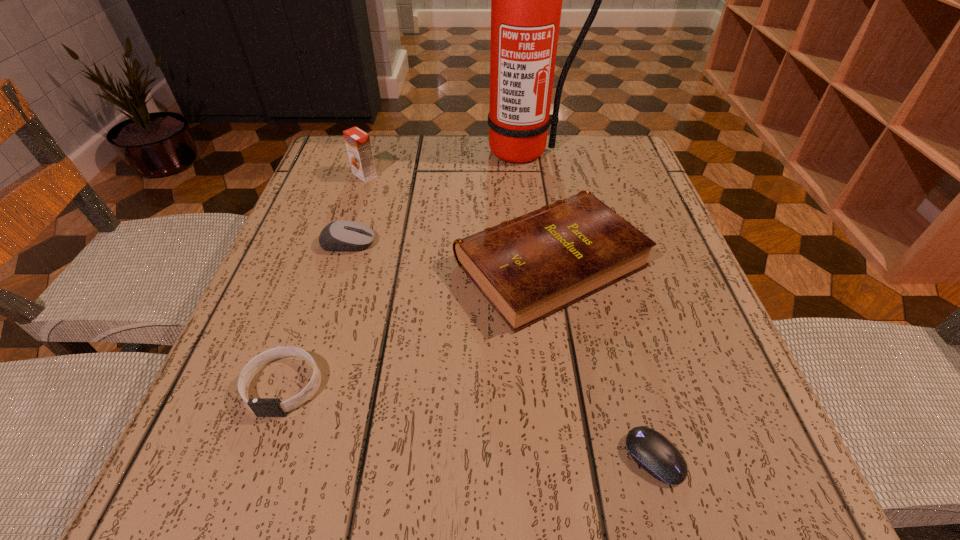
The image size is (960, 540). Identify the location of free space located 0.290m on the handle side of the fire extinguisher. (537, 252).

Where is `vacant area located 0.400m on the front of the orange juice`? This screenshot has width=960, height=540. vacant area located 0.400m on the front of the orange juice is located at coordinates (316, 324).

Identify the location of vacant space located 0.060m on the left of the third tallest object. (420, 264).

You are a GUI agent. You are given a task and a screenshot of the screen. Output one action in this format:
    pyautogui.click(x=<x>, y=<y>)
    Task: Click on the vacant space located 0.150m on the wheel side of the farther computer mouse
    
    Given the screenshot: What is the action you would take?
    pyautogui.click(x=454, y=243)

This screenshot has height=540, width=960. Identify the location of vacant point located 0.050m on the outer surface of the second nearest object. (259, 454).

Find the location of a particular element. The height and width of the screenshot is (540, 960). free space located on the back of the nearer computer mouse is located at coordinates (609, 291).

Locate an element on the screen. The image size is (960, 540). fire extinguisher present at the far edge is located at coordinates (526, 0).

This screenshot has width=960, height=540. Identify the location of orange juice present at the far edge. (358, 145).

The width and height of the screenshot is (960, 540). I want to click on object that is positioned at the near edge, so click(x=648, y=448).

This screenshot has width=960, height=540. What are the coordinates of `orange juice that is at the left edge` in the screenshot? It's located at (358, 145).